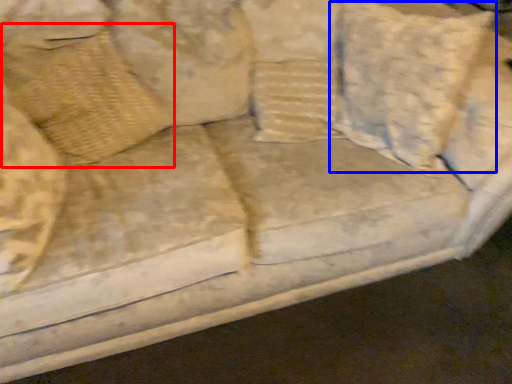
Question: Which object is closer to the camera taking this photo, pillow (highlighted by a red box) or pillow (highlighted by a blue box)?

Choices:
 (A) pillow
 (B) pillow

Answer: (B)